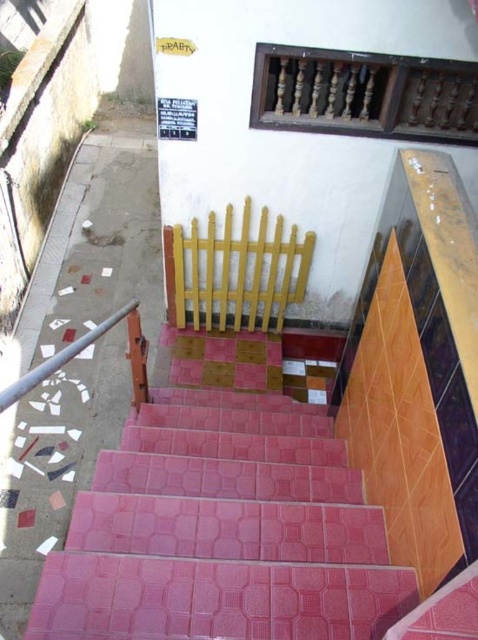
Between wooden balustrade at upper center and metallic pole at left, which one appears on the right side from the viewer's perspective?

Positioned to the right is wooden balustrade at upper center.

Is wooden balustrade at upper center shorter than metallic pole at left?

No.

Is point (319, 122) farther from viewer compared to point (17, 397)?

Yes, it is behind point (17, 397).

The image size is (478, 640). I want to click on wooden balustrade at upper center, so click(x=365, y=93).